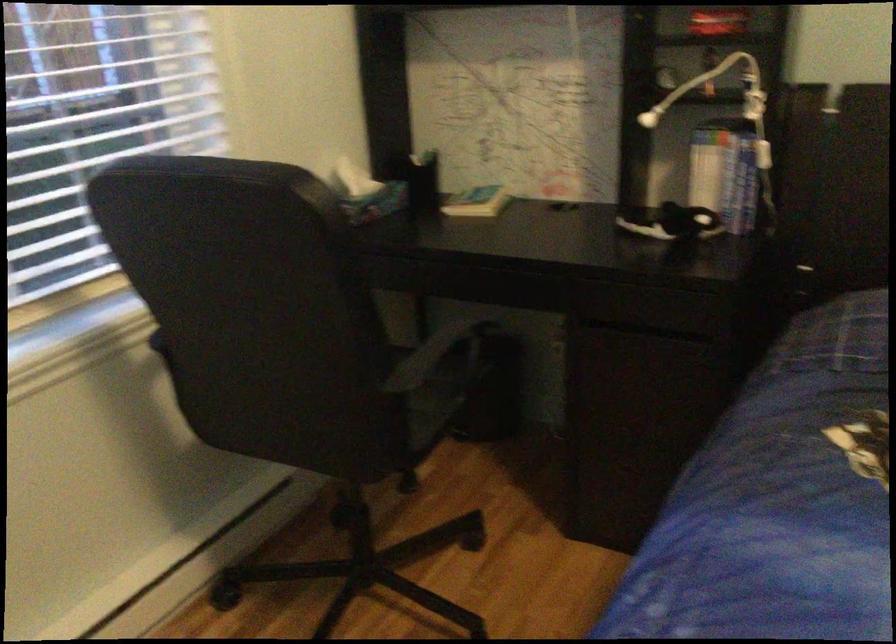
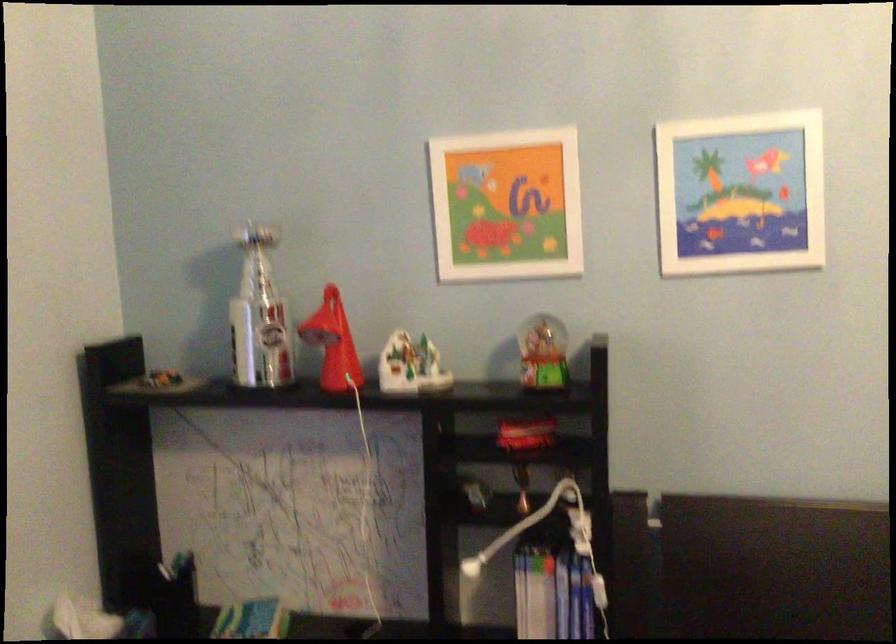
Based on the continuous images, in which direction is the camera rotating?

The camera rotated toward right-up.